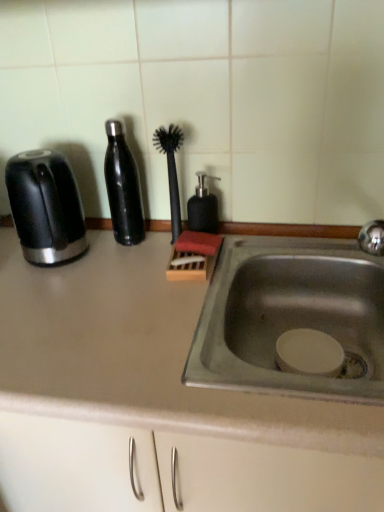
This screenshot has height=512, width=384. I want to click on free space above matte gray countertop at center (from a real-world perspective), so click(x=129, y=295).